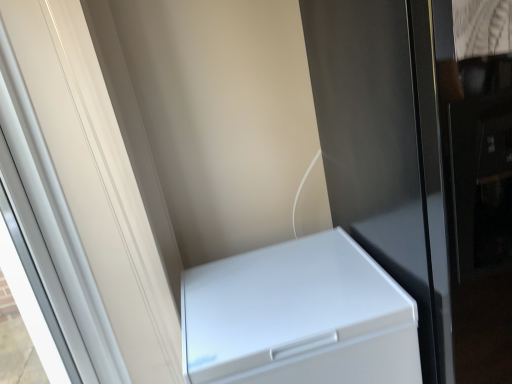
Question: Would you say white glossy screen door at left, the second screen door in the right-to-left sequence, is inside or outside white matte refrigerator at lower right?

Choices:
 (A) outside
 (B) inside

Answer: (A)

Question: Looking at their shapes, would you say white glossy screen door at left, the 1th screen door from the left, is wider or thinner than white matte refrigerator at lower right?

Choices:
 (A) thin
 (B) wide

Answer: (A)

Question: Considering the real-world distances, which object is farthest from the white glossy screen door at left, the second screen door in the right-to-left sequence?

Choices:
 (A) glossy black screen door at lower right, the first screen door from the right
 (B) white matte refrigerator at lower right

Answer: (A)

Question: Based on their relative distances, which object is farther from the glossy black screen door at lower right, the first screen door from the right?

Choices:
 (A) white glossy screen door at left, the 1th screen door from the left
 (B) white matte refrigerator at lower right

Answer: (A)